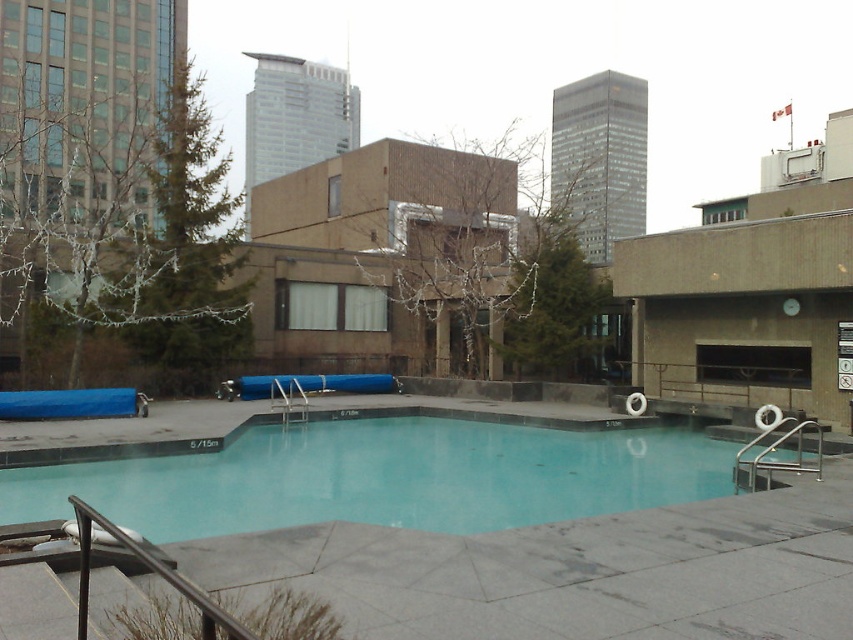
Question: Does clear glass pool at center appear over stainless steel handrail at right?

Choices:
 (A) no
 (B) yes

Answer: (B)

Question: Which of the following is the farthest from the observer?

Choices:
 (A) (526, 461)
 (B) (199, 596)
 (C) (764, 458)

Answer: (A)

Question: Among these points, which one is farthest from the camera?

Choices:
 (A) (173, 483)
 (B) (204, 609)

Answer: (A)

Question: Does black metal/rail at lower left lie behind stainless steel handrail at right?

Choices:
 (A) no
 (B) yes

Answer: (A)

Question: Can you confirm if clear glass pool at center is positioned below stainless steel handrail at right?

Choices:
 (A) no
 (B) yes

Answer: (A)

Question: Considering the real-world distances, which object is closest to the clear glass pool at center?

Choices:
 (A) black metal/rail at lower left
 (B) stainless steel handrail at right

Answer: (B)